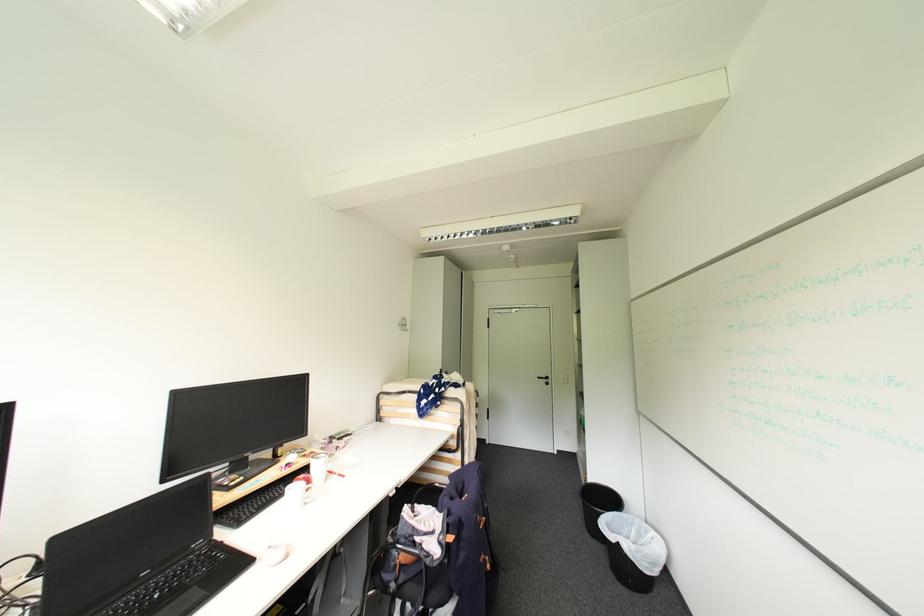
Find where to grasp the silver chair armrest. Please return your answer as a coordinate pair (x, y).

(411, 553)